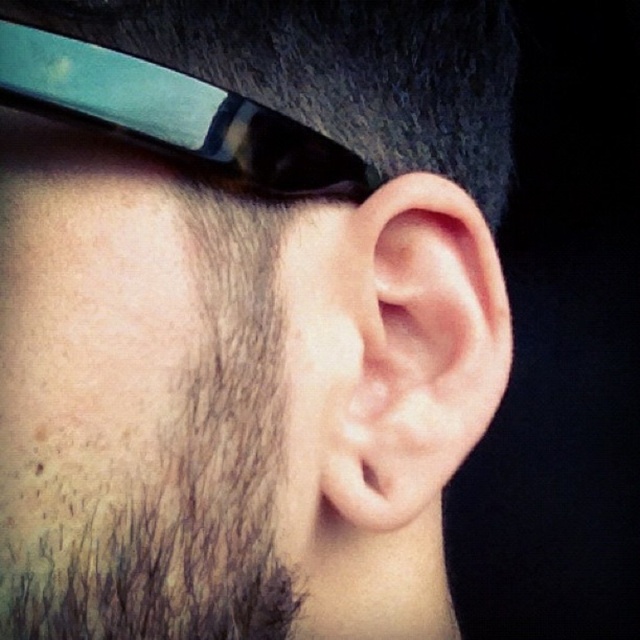
Can you confirm if dark brown hair at lower left is positioned below pink flesh-colored ear at center?

Yes, dark brown hair at lower left is below pink flesh-colored ear at center.

Is point (218, 522) positioned in front of point (355, 289)?

Yes, point (218, 522) is closer to viewer.

In order to click on dark brown hair at lower left in this screenshot , I will do `click(193, 484)`.

Can you confirm if pink flesh-colored ear at center is shorter than metallic blue goggles at upper left?

No, pink flesh-colored ear at center is not shorter than metallic blue goggles at upper left.

Is pink flesh-colored ear at center above metallic blue goggles at upper left?

Incorrect, pink flesh-colored ear at center is not positioned above metallic blue goggles at upper left.

Measure the distance between pink flesh-colored ear at center and camera.

The distance of pink flesh-colored ear at center from camera is 36.19 centimeters.

Locate an element on the screen. pink flesh-colored ear at center is located at coordinates (413, 349).

Is dark brown hair at lower left further to the viewer compared to metallic blue goggles at upper left?

Yes, dark brown hair at lower left is further from the viewer.

Is point (260, 612) more distant than point (195, 81)?

Yes, it is.

Is point (186, 593) less distant than point (131, 65)?

No, it is not.

This screenshot has height=640, width=640. I want to click on dark brown hair at lower left, so click(x=193, y=484).